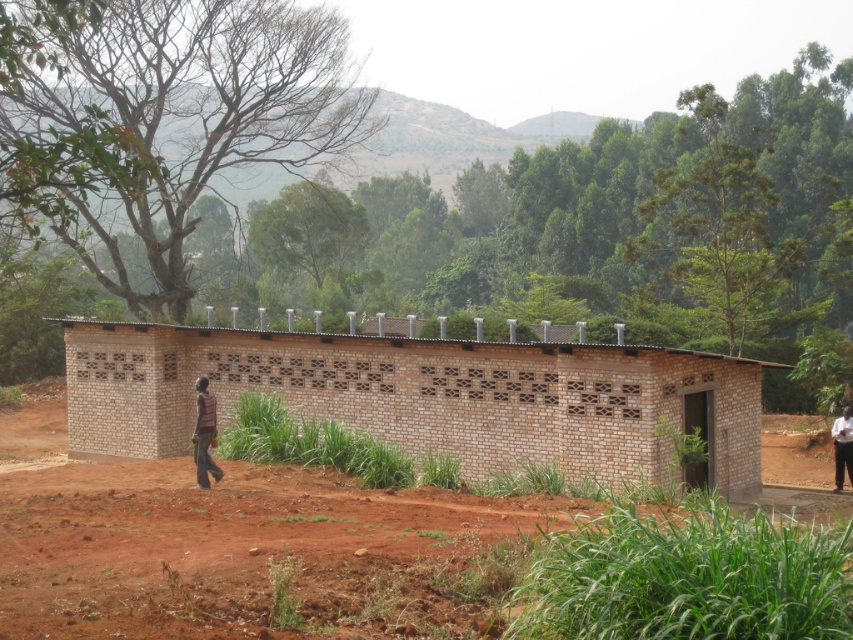
Is brown dirt field at center thinner than brown brick hut at center?

No, brown dirt field at center is not thinner than brown brick hut at center.

Does brown dirt field at center have a lesser height compared to brown brick hut at center?

Correct, brown dirt field at center is not as tall as brown brick hut at center.

Locate an element on the screen. This screenshot has width=853, height=640. brown dirt field at center is located at coordinates (256, 554).

Is brown brick hut at center smaller than striped fabric shirt at lower left?

Incorrect, brown brick hut at center is not smaller in size than striped fabric shirt at lower left.

Is point (354, 355) behind point (198, 442)?

That is True.

What do you see at coordinates (425, 397) in the screenshot? I see `brown brick hut at center` at bounding box center [425, 397].

At what (x,y) coordinates should I click in order to perform the action: click on brown brick hut at center. Please return your answer as a coordinate pair (x, y). The height and width of the screenshot is (640, 853). Looking at the image, I should click on (425, 397).

Is point (500, 621) more distant than point (837, 460)?

No, (500, 621) is closer to viewer.

Can you confirm if brown dirt field at center is thinner than dark brown leather jacket at lower right?

In fact, brown dirt field at center might be wider than dark brown leather jacket at lower right.

The width and height of the screenshot is (853, 640). What are the coordinates of `brown dirt field at center` in the screenshot? It's located at (256, 554).